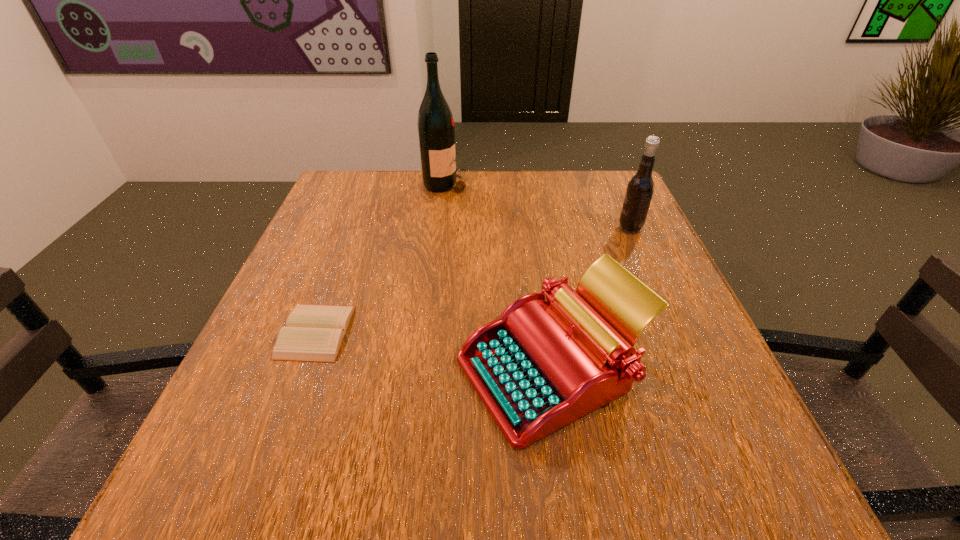
Image resolution: width=960 pixels, height=540 pixels. I want to click on wine bottle, so click(436, 131).

What are the coordinates of `the farthest object` in the screenshot? It's located at (436, 131).

At what (x,y) coordinates should I click in order to perform the action: click on root beer. Please return your answer as a coordinate pair (x, y). This screenshot has width=960, height=540. Looking at the image, I should click on (640, 188).

Locate an element on the screen. This screenshot has height=540, width=960. the rightmost object is located at coordinates (640, 188).

In order to click on the third tallest object in this screenshot , I will do `click(540, 366)`.

I want to click on the shortest object, so click(314, 333).

I want to click on diary, so click(314, 333).

You are a GUI agent. You are given a task and a screenshot of the screen. Output one action in this format:
    pyautogui.click(x=<x>, y=<y>)
    Task: Click on the free space located 0.240m on the front of the tallest object
    The image size is (960, 540).
    Given the screenshot: What is the action you would take?
    pyautogui.click(x=437, y=249)

Where is `vacant space located on the label of the third nearest object`? vacant space located on the label of the third nearest object is located at coordinates (505, 228).

The width and height of the screenshot is (960, 540). What are the coordinates of `vacant space situated 0.350m on the label of the third nearest object` in the screenshot? It's located at (471, 228).